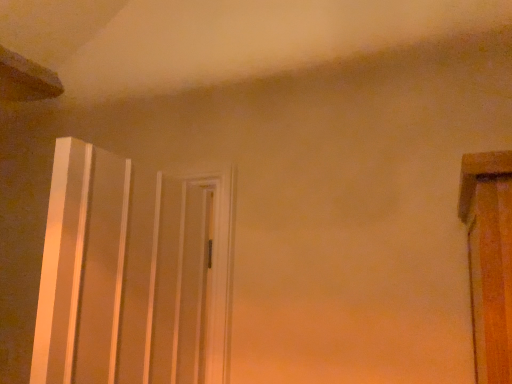
Identify the location of white glossy door at left. This screenshot has width=512, height=384. pos(131,273).

Describe the element at coordinates (131, 273) in the screenshot. The image size is (512, 384). I see `white glossy door at left` at that location.

Find the location of a particular element. Image resolution: width=512 pixels, height=384 pixels. white glossy door at left is located at coordinates (131, 273).